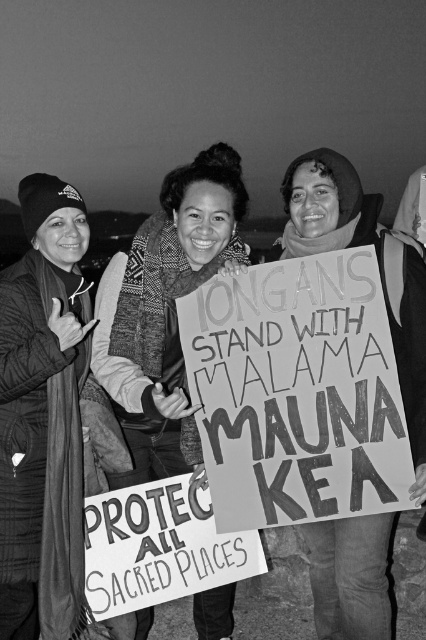
Which is more to the right, handwritten cardboard sign at center or knitted scarf at center?

Positioned to the right is handwritten cardboard sign at center.

Consider the image. Between handwritten cardboard sign at center and knitted scarf at center, which one has more height?

knitted scarf at center

What do you see at coordinates (296, 392) in the screenshot? I see `handwritten cardboard sign at center` at bounding box center [296, 392].

The width and height of the screenshot is (426, 640). I want to click on handwritten cardboard sign at center, so click(296, 392).

Who is shorter, plaid wool scarf at left or matte cardboard sign at center?

With less height is matte cardboard sign at center.

Does plaid wool scarf at left appear on the left side of matte cardboard sign at center?

Correct, you'll find plaid wool scarf at left to the left of matte cardboard sign at center.

Which is behind, point (2, 280) or point (193, 584)?

Point (193, 584)

The image size is (426, 640). In order to click on plaid wool scarf at left in this screenshot , I will do `click(43, 419)`.

Does knitted scarf at center have a greater height compared to matte cardboard sign at center?

Yes, knitted scarf at center is taller than matte cardboard sign at center.

Is point (209, 246) positioned behind point (143, 513)?

That is True.

At what (x,y) coordinates should I click in order to perform the action: click on knitted scarf at center. Please return your answer as a coordinate pair (x, y). This screenshot has height=640, width=426. Looking at the image, I should click on (164, 310).